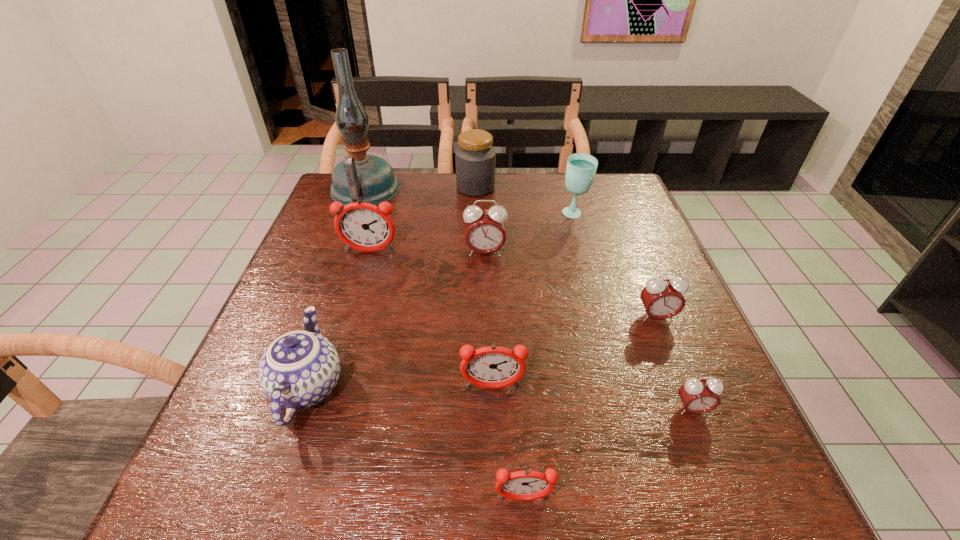
The width and height of the screenshot is (960, 540). I want to click on free region at the right edge of the desktop, so coord(660,338).

You are a GUI agent. You are given a task and a screenshot of the screen. Output one action in this format:
    pyautogui.click(x=<x>, y=<y>)
    Task: Click on the free space at the far right corner of the desktop
    The width and height of the screenshot is (960, 540).
    Given the screenshot: What is the action you would take?
    pyautogui.click(x=631, y=204)

The height and width of the screenshot is (540, 960). What are the coordinates of `vacant area that lies between the leftmost alarm clock and the leftmost pink alarm clock` in the screenshot? It's located at (427, 252).

Locate an element on the screen. This screenshot has width=960, height=540. vacant area that lies between the second farthest reddish-pink alarm clock and the glass is located at coordinates (533, 301).

Locate an element on the screen. The height and width of the screenshot is (540, 960). free space between the gray jar and the smallest pink alarm clock is located at coordinates (584, 298).

At what (x,y) coordinates should I click in order to perform the action: click on empty space that is in between the second biggest reddish-pink alarm clock and the leftmost reddish-pink alarm clock. Please return your answer as a coordinate pair (x, y). The image size is (960, 540). Looking at the image, I should click on point(431,320).

Find the location of a particular element. vacant space in between the smallest pink alarm clock and the second farthest reddish-pink alarm clock is located at coordinates (592, 399).

Find the location of a particular element. The width and height of the screenshot is (960, 540). free spot between the jar and the nearest pink alarm clock is located at coordinates (584, 298).

Where is `vacant area that lies between the second nearest alarm clock and the biggest pink alarm clock`? This screenshot has height=540, width=960. vacant area that lies between the second nearest alarm clock and the biggest pink alarm clock is located at coordinates (588, 330).

Where is `empty space that is in between the biggest pink alarm clock and the blue chinaware`? empty space that is in between the biggest pink alarm clock and the blue chinaware is located at coordinates (396, 319).